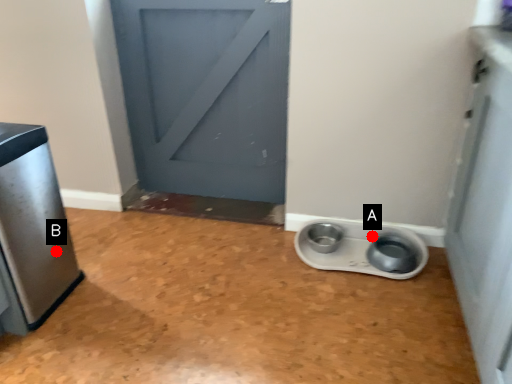
Question: Two points are circled on the image, labeled by A and B beside each circle. Which point is farther from the camera taking this photo?

Choices:
 (A) A is further
 (B) B is further

Answer: (A)